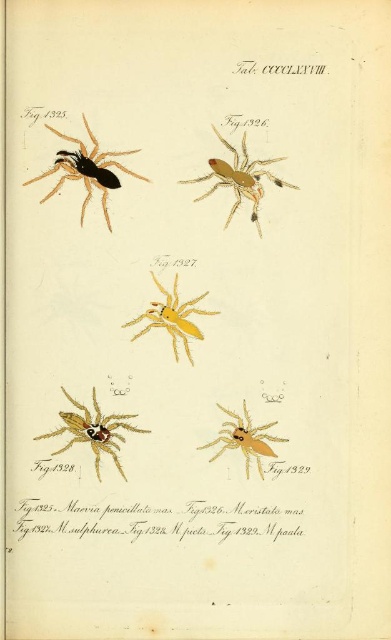
Which is in front, point (82, 406) or point (172, 320)?

Point (82, 406)

Describe the element at coordinates (93, 429) in the screenshot. I see `golden metallic spider at lower left` at that location.

What are the coordinates of `golden metallic spider at lower left` in the screenshot? It's located at 93,429.

Between point (86, 154) and point (233, 182), which one is positioned in front?

Point (86, 154) is more forward.

Is point (77, 144) positioned before point (247, 195)?

That is True.

The height and width of the screenshot is (640, 391). Find the location of `matte black spider at upper left`. matte black spider at upper left is located at coordinates (87, 170).

Can you confirm if matte yellow spider at center is positioned above yellow matte spider at center?

Yes.

Is matte yellow spider at center bigger than yellow matte spider at center?

Indeed, matte yellow spider at center has a larger size compared to yellow matte spider at center.

Is point (213, 129) behind point (181, 307)?

No, (213, 129) is in front of (181, 307).

In order to click on matte yellow spider at center in this screenshot , I will do `click(240, 179)`.